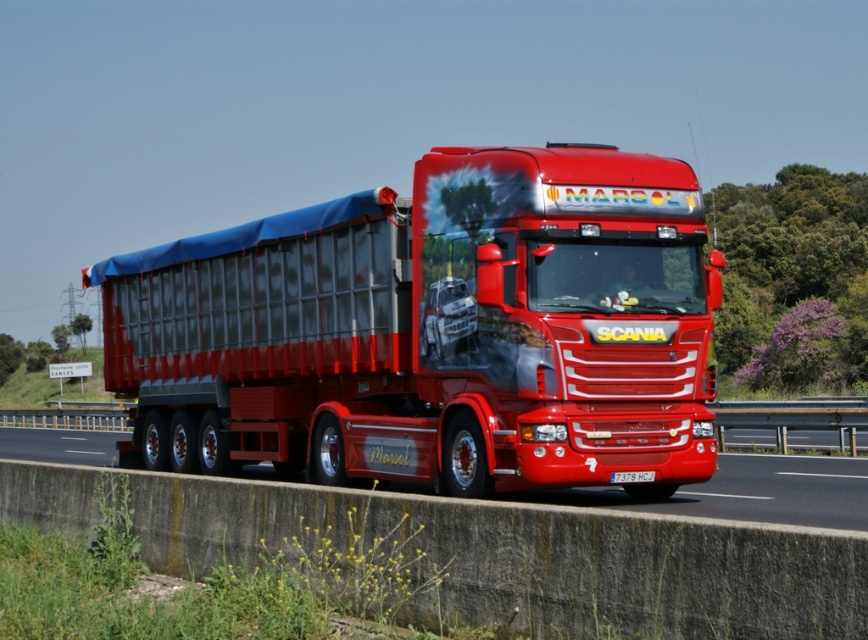
Consider the image. Is metallic silver trailer at center thinner than white plastic license plate at center?

Incorrect, metallic silver trailer at center's width is not less than white plastic license plate at center's.

Can you confirm if metallic silver trailer at center is positioned above white plastic license plate at center?

Correct, metallic silver trailer at center is located above white plastic license plate at center.

Is point (301, 388) farther from camera compared to point (635, 480)?

Yes, it is.

Locate an element on the screen. The image size is (868, 640). metallic silver trailer at center is located at coordinates (435, 330).

Image resolution: width=868 pixels, height=640 pixels. What do you see at coordinates (435, 330) in the screenshot?
I see `metallic silver trailer at center` at bounding box center [435, 330].

Does metallic silver trailer at center appear over metallic asphalt at center?

Indeed, metallic silver trailer at center is positioned over metallic asphalt at center.

Between point (590, 305) and point (773, 493), which one is positioned behind?

The point (773, 493) is more distant.

Locate an element on the screen. This screenshot has width=868, height=640. metallic silver trailer at center is located at coordinates [x=435, y=330].

Who is lower down, metallic asphalt at center or white plastic license plate at center?

metallic asphalt at center

Can you confirm if metallic asphalt at center is taller than white plastic license plate at center?

Indeed, metallic asphalt at center has a greater height compared to white plastic license plate at center.

Which is behind, point (860, 518) or point (635, 477)?

The point (635, 477) is more distant.

This screenshot has height=640, width=868. I want to click on metallic asphalt at center, so click(751, 492).